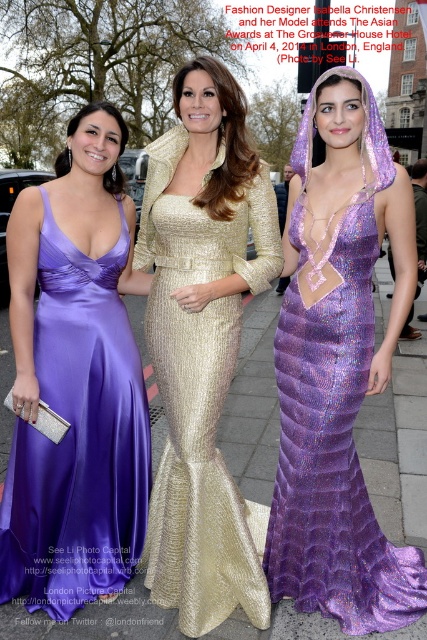
Question: Which of the following is the closest to the observer?

Choices:
 (A) purple satin dress at center
 (B) purple sequined dress at center

Answer: (B)

Question: Among these objects, which one is nearest to the camera?

Choices:
 (A) purple satin dress at center
 (B) purple sequined dress at center

Answer: (B)

Question: Does purple sequined dress at center appear over gold sequined dress at center?

Choices:
 (A) yes
 (B) no

Answer: (B)

Question: Is purple satin dress at center above purple sequined dress at center?

Choices:
 (A) yes
 (B) no

Answer: (B)

Question: Is the position of purple satin dress at center less distant than that of gold sequined dress at center?

Choices:
 (A) yes
 (B) no

Answer: (B)

Question: Estimate the real-world distances between objects in this image. Which object is closer to the gold sequined dress at center?

Choices:
 (A) purple sequined dress at center
 (B) purple satin dress at center

Answer: (B)